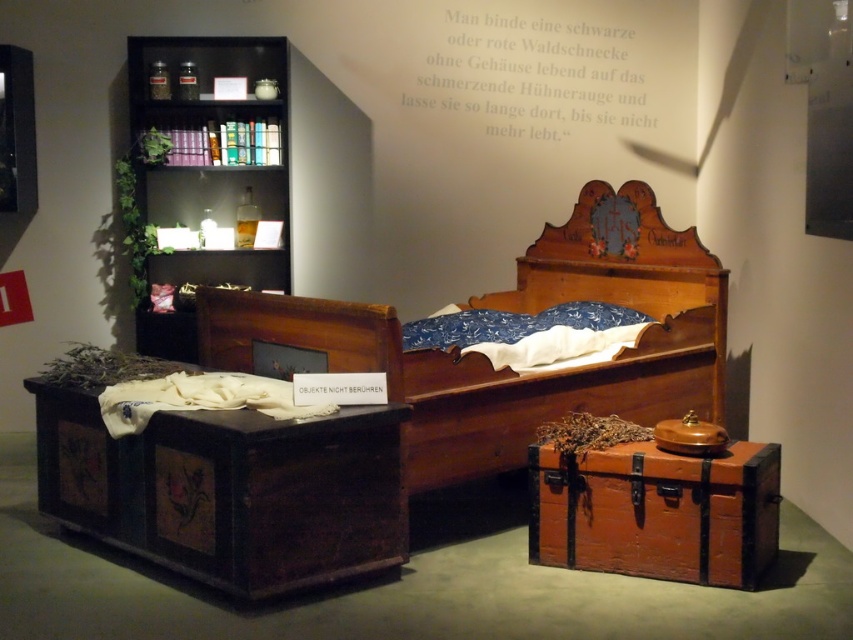
Does point (252, 310) come closer to viewer compared to point (474, 77)?

Yes, point (252, 310) is closer to viewer.

Is wooden bed at center to the right of white paper at upper center from the viewer's perspective?

Incorrect, wooden bed at center is not on the right side of white paper at upper center.

Which is behind, point (418, 460) or point (497, 76)?

Positioned behind is point (497, 76).

At what (x,y) coordinates should I click in order to perform the action: click on wooden bed at center. Please return your answer as a coordinate pair (x, y). The image size is (853, 640). Looking at the image, I should click on (508, 368).

Who is more forward, (x=607, y=280) or (x=265, y=284)?

Point (x=607, y=280) is in front.

Is point (206, 292) closer to camera compared to point (165, 323)?

Yes, point (206, 292) is in front of point (165, 323).

Is point (486, 422) positioned behind point (161, 45)?

No, (486, 422) is closer to viewer.

What are the coordinates of `wooden bed at center` in the screenshot? It's located at (508, 368).

Can you confirm if wooden bed at center is shorter than blue fabric pillow at center?

No, wooden bed at center is not shorter than blue fabric pillow at center.

Does wooden bed at center appear on the right side of blue fabric pillow at center?

Incorrect, wooden bed at center is not on the right side of blue fabric pillow at center.

Which is behind, point (670, 282) or point (566, 312)?

The point (670, 282) is more distant.

At what (x,y) coordinates should I click in order to perform the action: click on wooden bed at center. Please return your answer as a coordinate pair (x, y). The image size is (853, 640). Looking at the image, I should click on (508, 368).